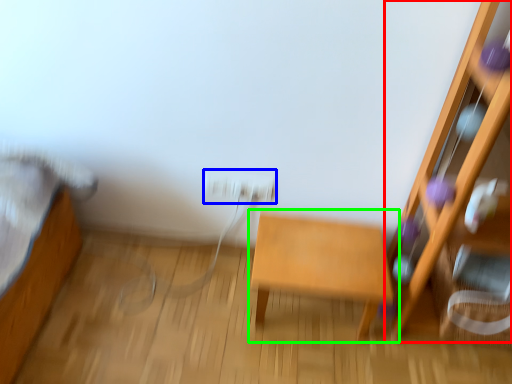
Question: Based on their relative distances, which object is nearer to furniture (highlighted by a red box)? Choose from electric outlet (highlighted by a blue box) and table (highlighted by a green box).

Choices:
 (A) electric outlet
 (B) table

Answer: (B)